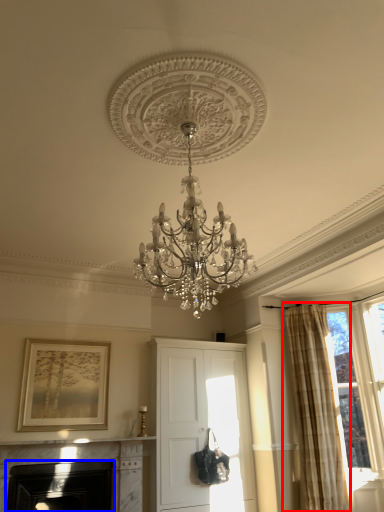
Question: Which object appears closest to the camera in this image, curtain (highlighted by a red box) or fireplace (highlighted by a blue box)?

Choices:
 (A) curtain
 (B) fireplace

Answer: (B)